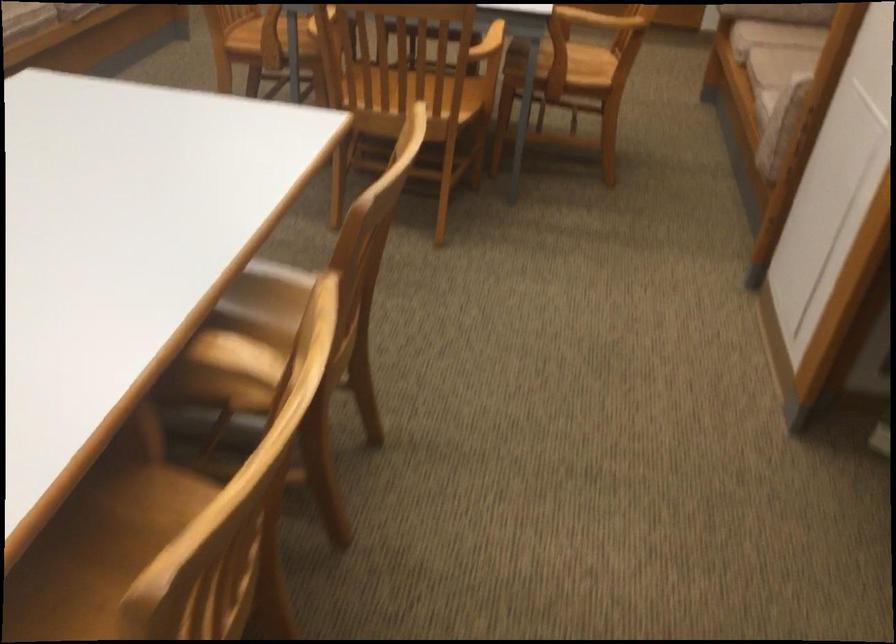
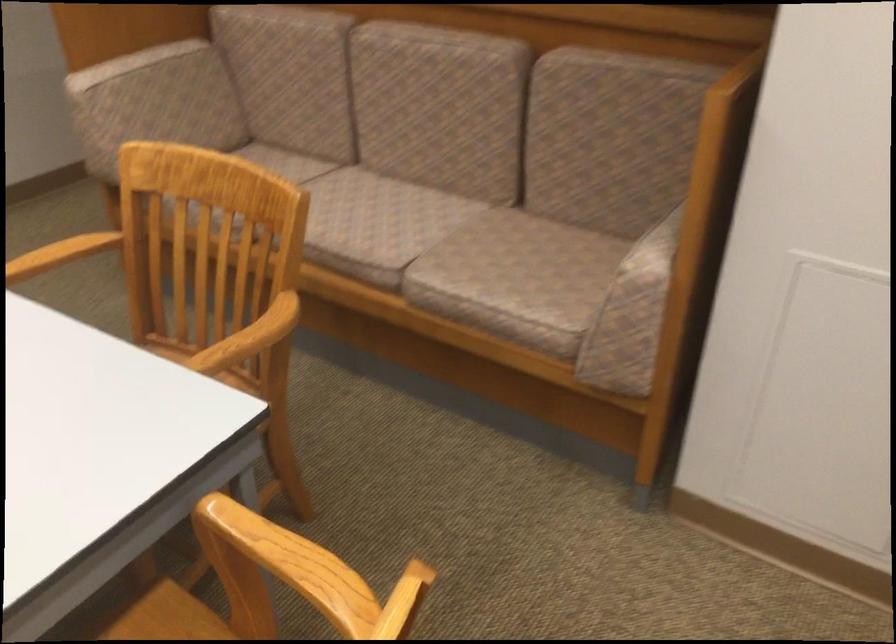
Question: I am providing you with two images of the same scene from different viewpoints. Please identify which objects are invisible in image2.

Choices:
 (A) white wardrobe zipper
 (B) wooden chair armrest
 (C) sofa sitting surface
 (D) upholstered sofa armrest

Answer: (C)